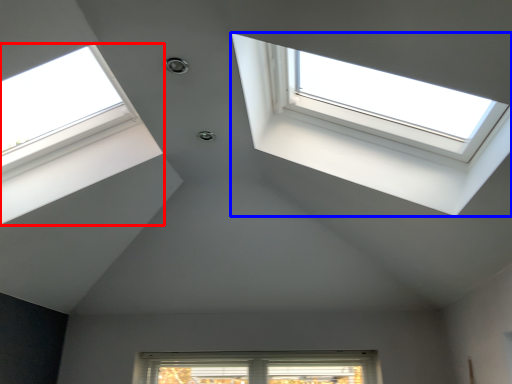
Question: Among these objects, which one is nearest to the camera, window (highlighted by a red box) or window (highlighted by a blue box)?

Choices:
 (A) window
 (B) window

Answer: (B)